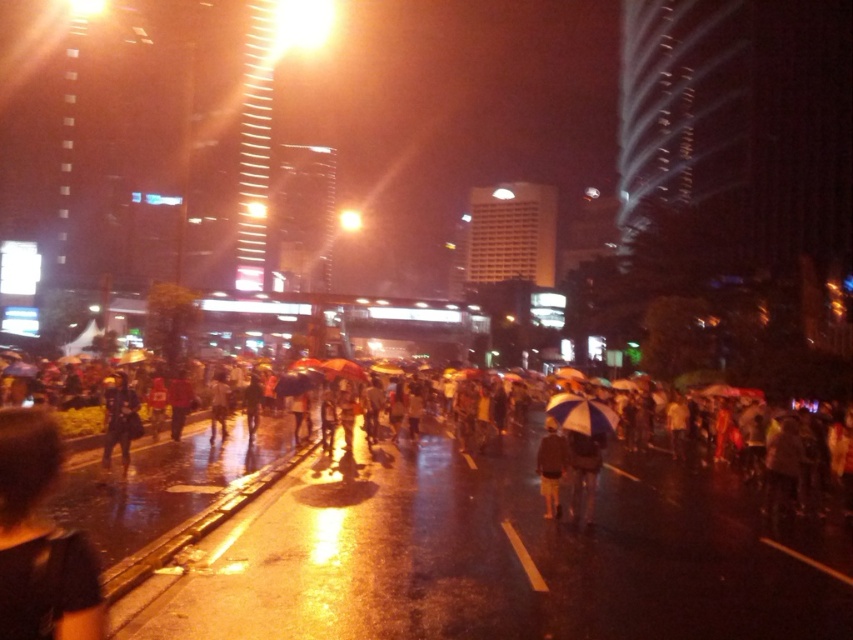
Question: Which object is positioned farthest from the white matte umbrella at center?

Choices:
 (A) dark gray umbrella at center
 (B) dark brown leather jacket at center

Answer: (A)

Question: Among these objects, which one is nearest to the camera?

Choices:
 (A) dark blue jacket at left
 (B) white matte umbrella at center
 (C) dark gray umbrella at center
 (D) dark brown leather jacket at center

Answer: (C)

Question: Which point appears closest to the camera in this image?

Choices:
 (A) (538, 412)
 (B) (138, 417)
 (C) (555, 490)

Answer: (C)

Question: Where is dark blue jacket at left located in relation to white matte umbrella at center in the image?

Choices:
 (A) right
 (B) left

Answer: (B)

Question: Does dark gray umbrella at center have a smaller size compared to dark blue jacket at left?

Choices:
 (A) yes
 (B) no

Answer: (B)

Question: Can you confirm if dark blue jacket at left is positioned above dark brown leather jacket at center?

Choices:
 (A) yes
 (B) no

Answer: (A)